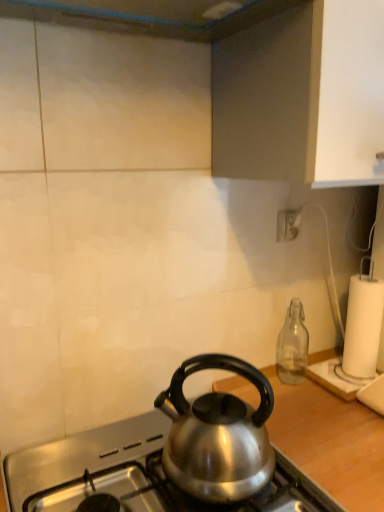
Where is `unoccupied region to the right of transparent glass bottle at right`? This screenshot has height=512, width=384. unoccupied region to the right of transparent glass bottle at right is located at coordinates (328, 376).